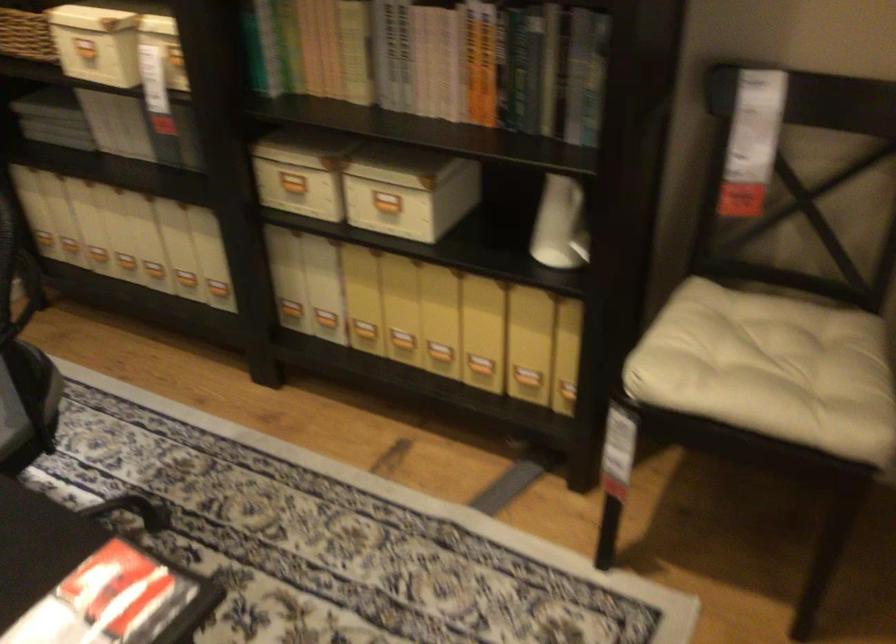
Find the location of `chair sitting surface`. chair sitting surface is located at coordinates (776, 366).